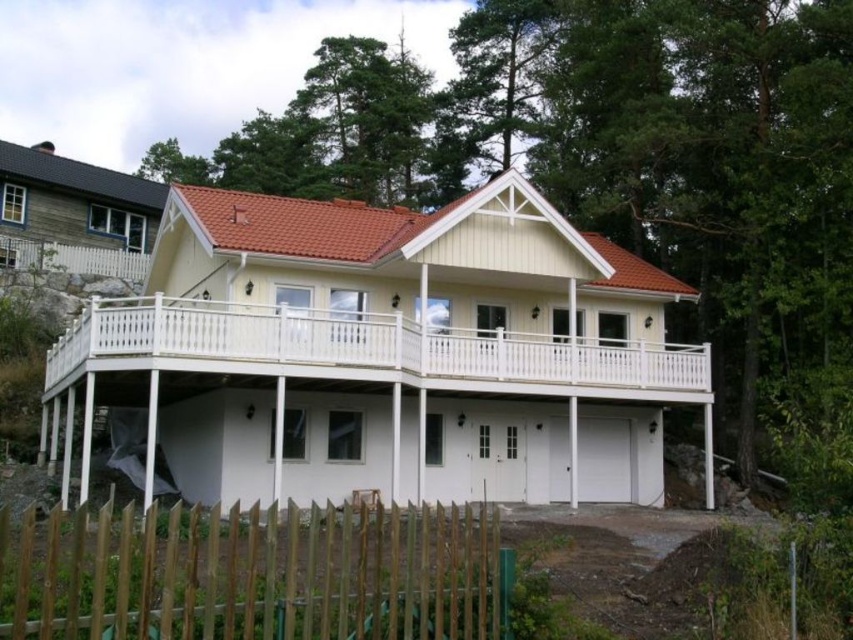
Question: Does white painted wood balcony at center have a smaller size compared to brown wooden fence at lower left?

Choices:
 (A) no
 (B) yes

Answer: (A)

Question: Is white painted wood balcony at center wider than brown wooden fence at lower left?

Choices:
 (A) yes
 (B) no

Answer: (A)

Question: Among these objects, which one is nearest to the camera?

Choices:
 (A) white painted wood balcony at center
 (B) brown wooden fence at lower left

Answer: (B)

Question: Can you confirm if white painted wood balcony at center is wider than brown wooden fence at lower left?

Choices:
 (A) no
 (B) yes

Answer: (B)